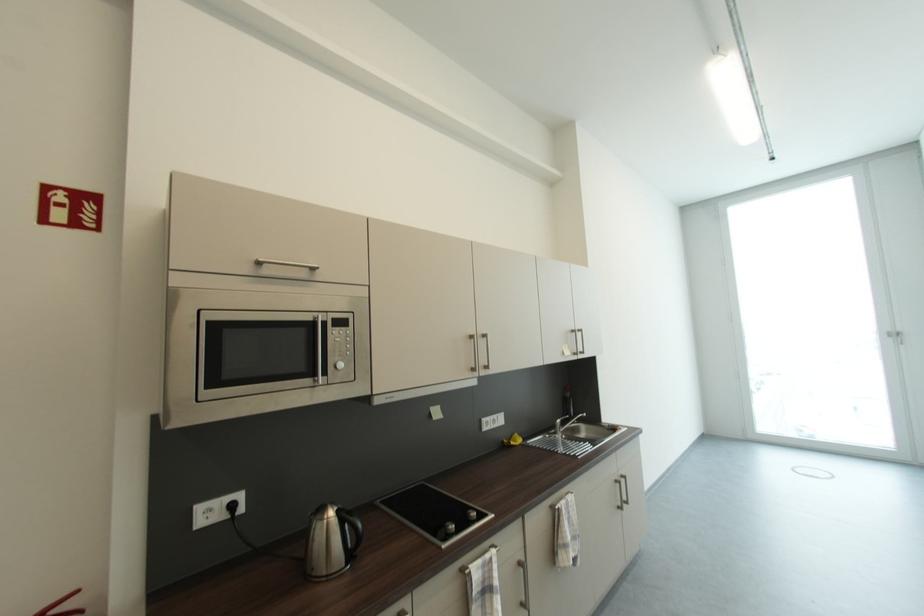
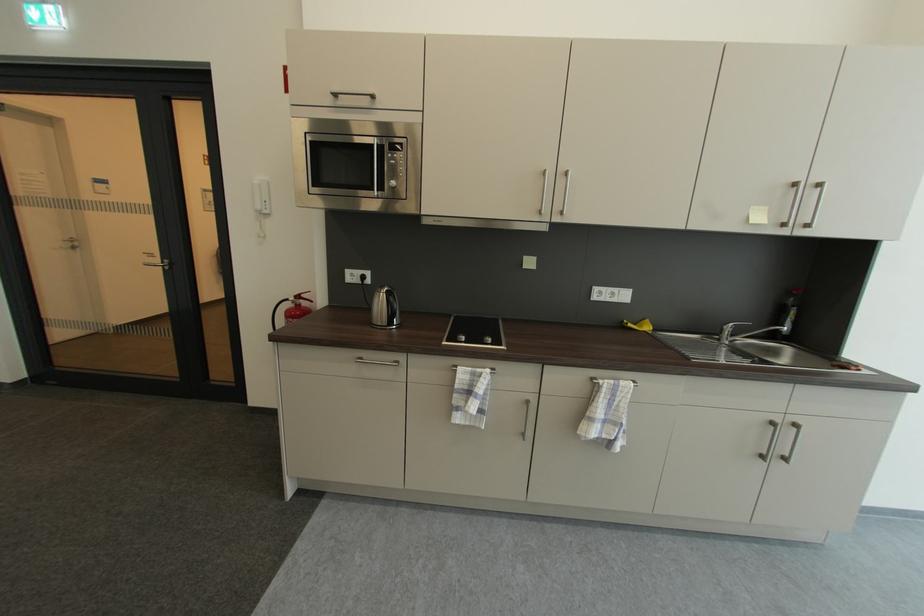
The point at (560, 434) is marked in the first image. Where is the corresponding point in the second image?

(723, 339)